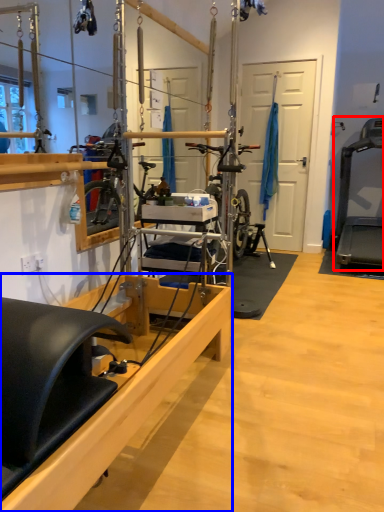
Question: Among these objects, which one is farthest to the camera, treadmill (highlighted by a red box) or furniture (highlighted by a blue box)?

Choices:
 (A) treadmill
 (B) furniture

Answer: (A)